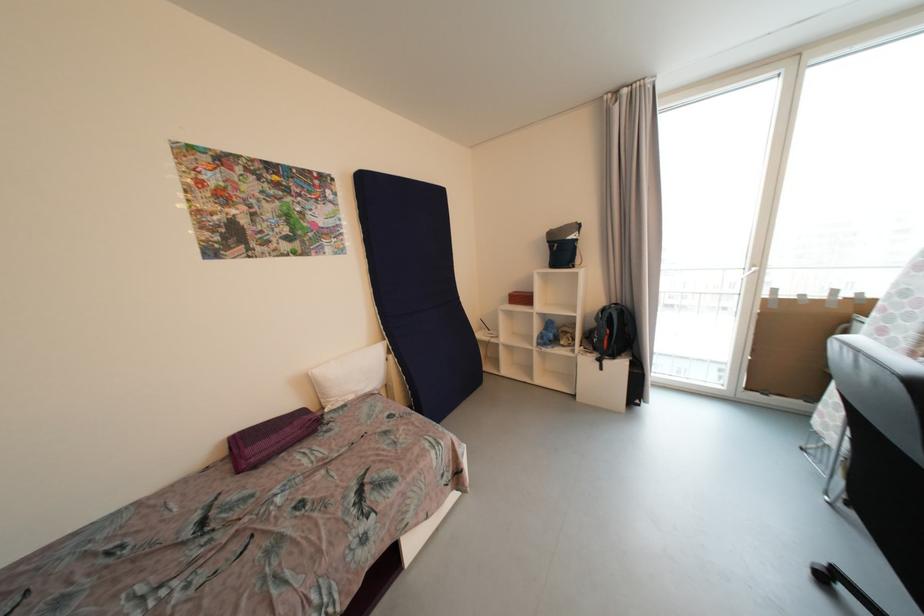
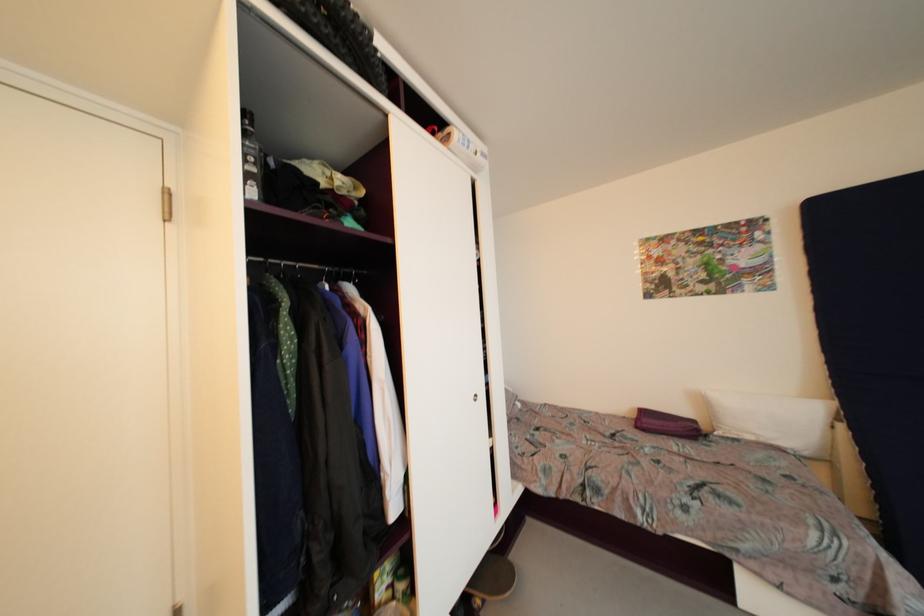
Find the pixel in the second image that matches (383,389) in the first image.

(810, 456)